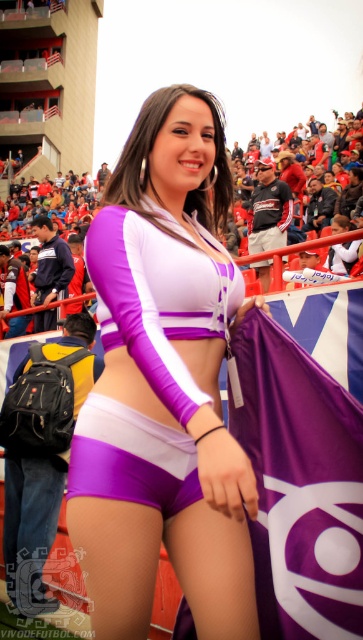
Looking at this image, you are a photographer trying to capture the purple matte shorts at center in the image. The focus point of your camera is set to the coordinates point (164, 385). Will this point ensure the purple matte shorts at center are in focus?

Yes, the point (164, 385) corresponds to the purple matte shorts at center, so setting the focus point there will ensure they are in focus.

You are a photographer at the soccer match. You need to capture a photo where both the purple matte shorts at center and the purple fabric flag at center are clearly visible. Given their sizes, which object should you focus on to ensure both are in frame without cropping?

The purple matte shorts at center is larger than the purple fabric flag at center, so focusing on the purple matte shorts at center will ensure both objects remain in frame without cropping.